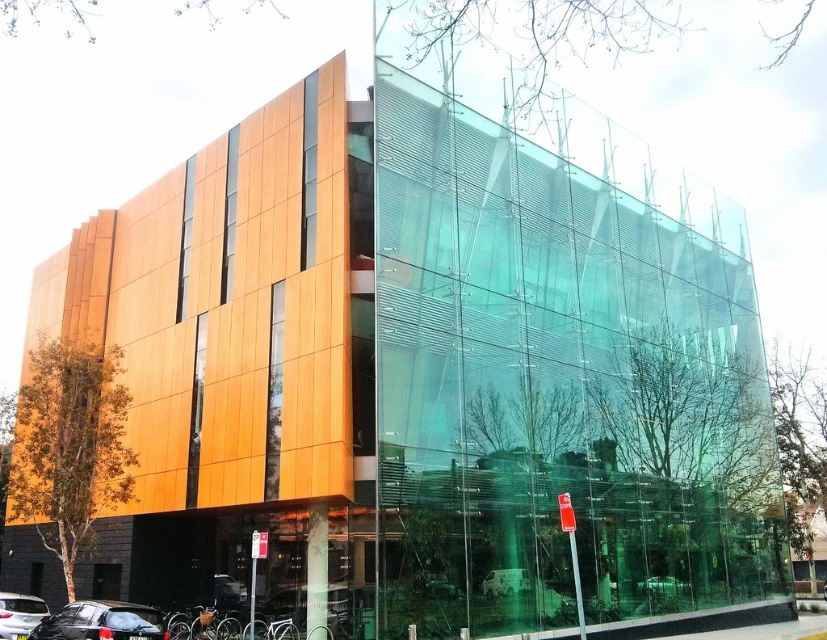
You are a pedestrian standing in front of the modern building with the wooden and glass facades. You notice a black matte car at lower left and a metallic silver car at center. Which car is closer to you?

The black matte car at lower left is closer to you because it is positioned in front of the metallic silver car at center.

You are standing in front of the modern building and see the shiny black car at lower left and the metallic silver car at center. Which car is positioned higher relative to the other?

The shiny black car at lower left is located above the metallic silver car at center, so it is positioned higher.